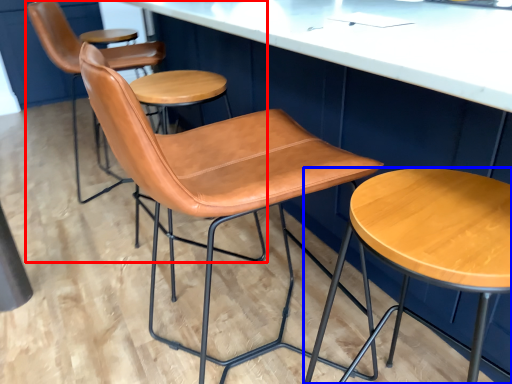
Question: Which object is further to the camera taking this photo, chair (highlighted by a red box) or stool (highlighted by a blue box)?

Choices:
 (A) chair
 (B) stool

Answer: (A)